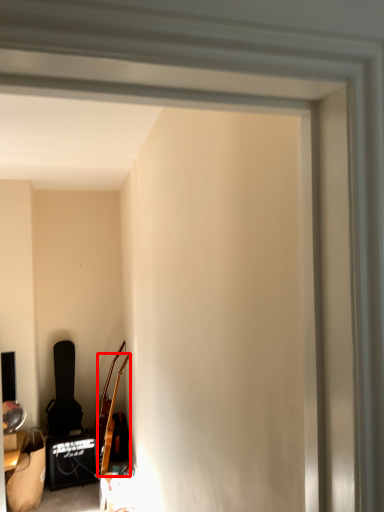
Question: From the image's perspective, what is the correct spatial relationship of guitar (annotated by the red box) in relation to chair?

Choices:
 (A) above
 (B) below

Answer: (B)